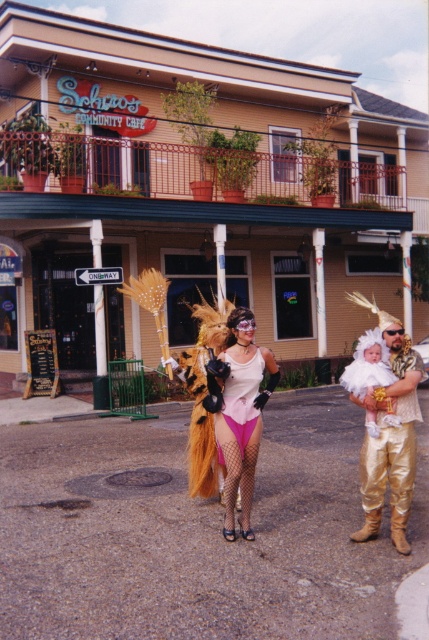
Question: Does shiny gold costume at center come behind pink fishnet stockings at center?

Choices:
 (A) yes
 (B) no

Answer: (B)

Question: Which object appears farthest from the camera in this image?

Choices:
 (A) pink satin dress at center
 (B) shiny gold costume at center

Answer: (A)

Question: Which is farther from the pink fishnet stockings at center?

Choices:
 (A) pink satin dress at center
 (B) shiny gold costume at center

Answer: (B)

Question: Which point is closer to the camera?

Choices:
 (A) shiny gold costume at center
 (B) pink fishnet stockings at center

Answer: (A)

Question: In this image, where is shiny gold costume at center located relative to pink fishnet stockings at center?

Choices:
 (A) left
 (B) right

Answer: (B)

Question: Is pink fishnet stockings at center bigger than pink satin dress at center?

Choices:
 (A) yes
 (B) no

Answer: (A)